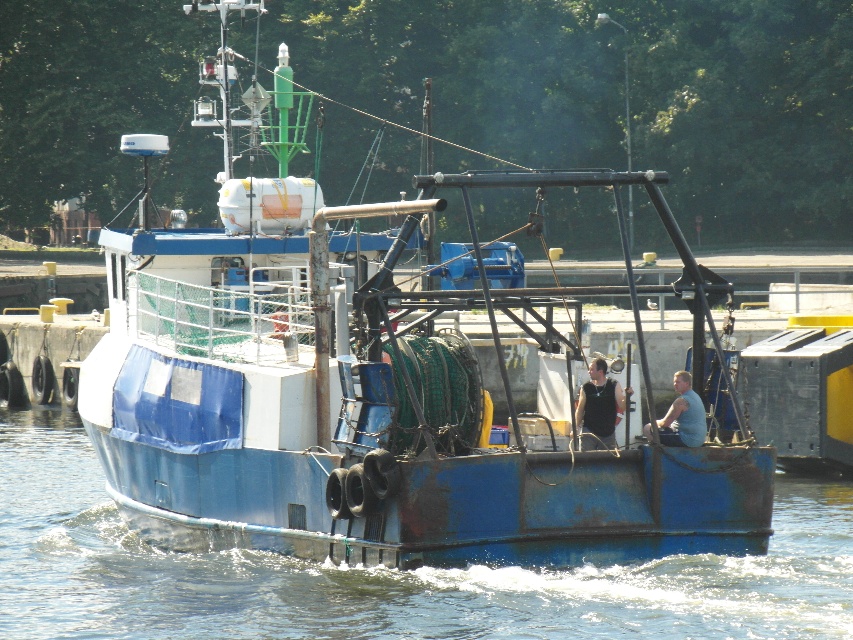
You are standing on the deck of the fishing boat and want to move from the blue metallic water at center to the black tank top at center. Can you walk directly between them without needing to step around any obstacles?

The distance between the blue metallic water at center and the black tank top at center is 14.25 feet, so yes, you can walk directly between them without needing to step around any obstacles as there is sufficient space.

You are a photographer standing on the dock and want to capture both the blue matte boat at center and the black tank top at center in your shot. Since you need to adjust your camera settings based on their sizes, which object should you focus on first to ensure proper focus if the boat is taller?

The blue matte boat at center is taller than the black tank top at center, so you should focus on the blue matte boat at center first to account for its larger size.